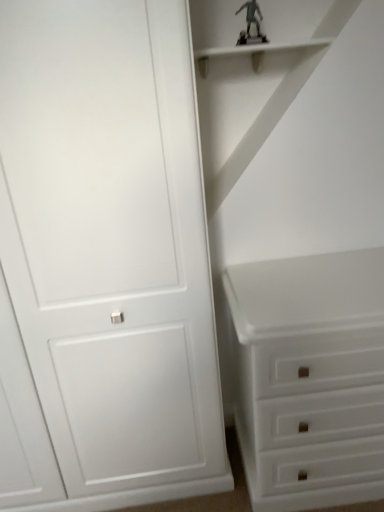
This screenshot has height=512, width=384. What are the coordinates of `white matte chest of drawers at lower right` in the screenshot? It's located at (309, 377).

The image size is (384, 512). What do you see at coordinates (309, 377) in the screenshot?
I see `white matte chest of drawers at lower right` at bounding box center [309, 377].

Find the location of a particular element. The width and height of the screenshot is (384, 512). white matte chest of drawers at lower right is located at coordinates (309, 377).